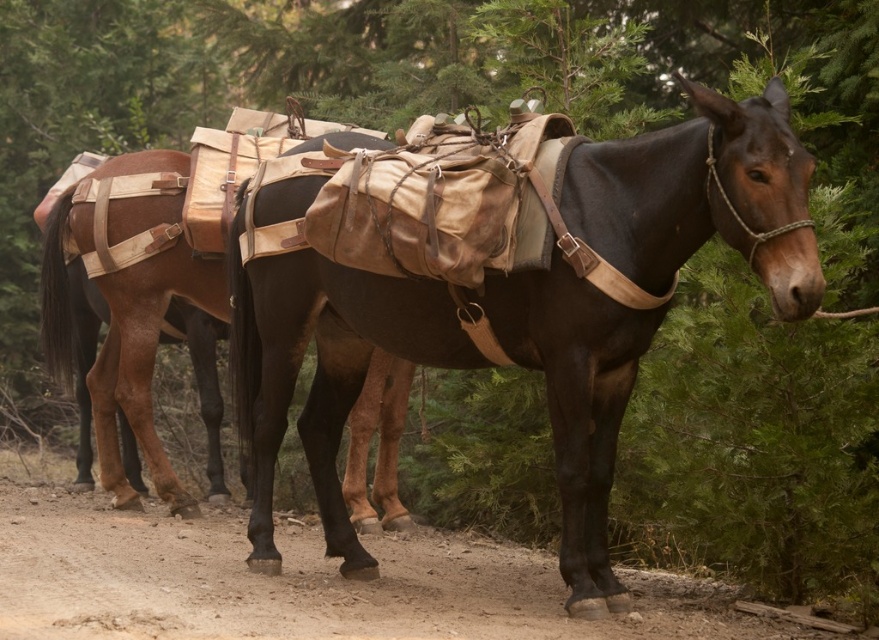
In the scene shown: Between brown leather saddle at center and dusty brown dirt track at center, which one is positioned higher?

brown leather saddle at center

Based on the photo, who is positioned more to the left, brown leather saddle at center or dusty brown dirt track at center?

Positioned to the left is dusty brown dirt track at center.

Is point (353, 396) closer to camera compared to point (49, 572)?

No, it is not.

In order to click on brown leather saddle at center in this screenshot , I will do `click(434, 365)`.